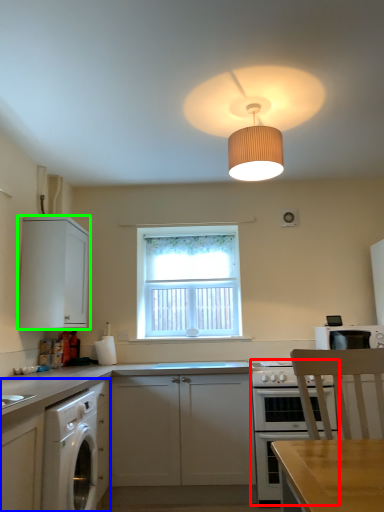
Question: Based on their relative distances, which object is farther from oven (highlighted by a red box)? Choose from cabinetry (highlighted by a blue box) and cabinetry (highlighted by a green box).

Choices:
 (A) cabinetry
 (B) cabinetry

Answer: (B)